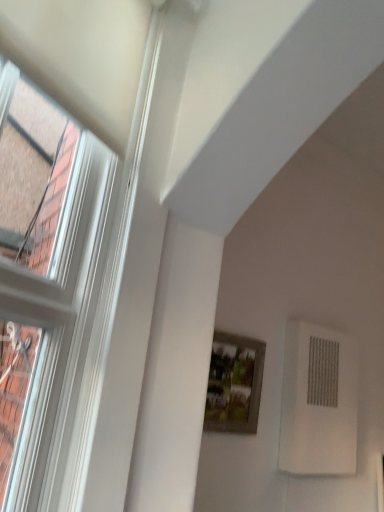
Question: Considering the positions of wooden framed picture at center and white textured air conditioning unit at lower right in the image, is wooden framed picture at center taller or shorter than white textured air conditioning unit at lower right?

Choices:
 (A) tall
 (B) short

Answer: (B)

Question: Based on their positions, is wooden framed picture at center located to the left or right of white textured air conditioning unit at lower right?

Choices:
 (A) left
 (B) right

Answer: (A)

Question: Which is correct: wooden framed picture at center is inside white textured air conditioning unit at lower right, or outside of it?

Choices:
 (A) outside
 (B) inside

Answer: (A)

Question: Does point (306, 437) appear closer or farther from the camera than point (251, 340)?

Choices:
 (A) closer
 (B) farther

Answer: (A)

Question: Considering the relative positions of white textured air conditioning unit at lower right and wooden framed picture at center in the image provided, is white textured air conditioning unit at lower right to the left or to the right of wooden framed picture at center?

Choices:
 (A) left
 (B) right

Answer: (B)

Question: Considering their positions, is white textured air conditioning unit at lower right located in front of or behind wooden framed picture at center?

Choices:
 (A) behind
 (B) front

Answer: (A)

Question: From a real-world perspective, is white textured air conditioning unit at lower right above or below wooden framed picture at center?

Choices:
 (A) above
 (B) below

Answer: (A)